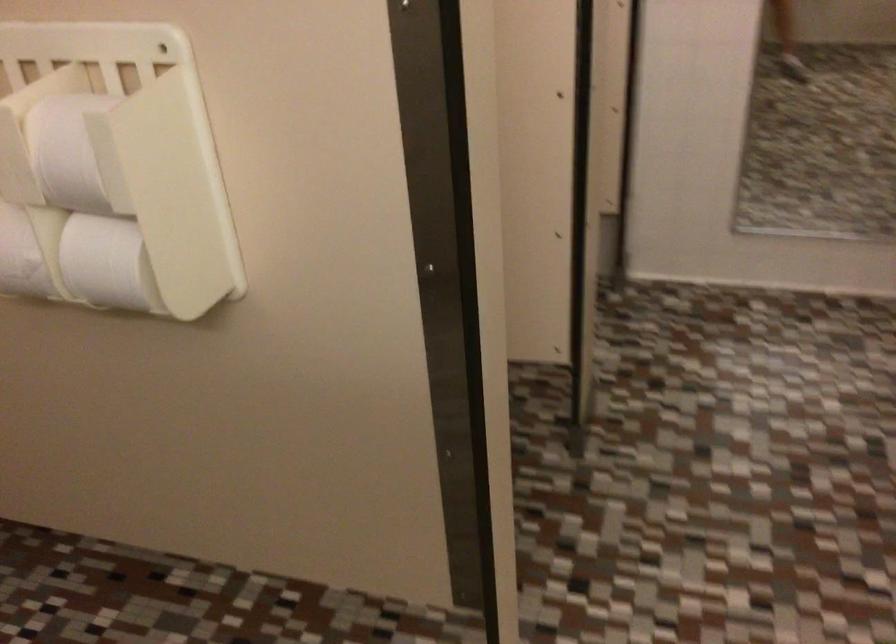
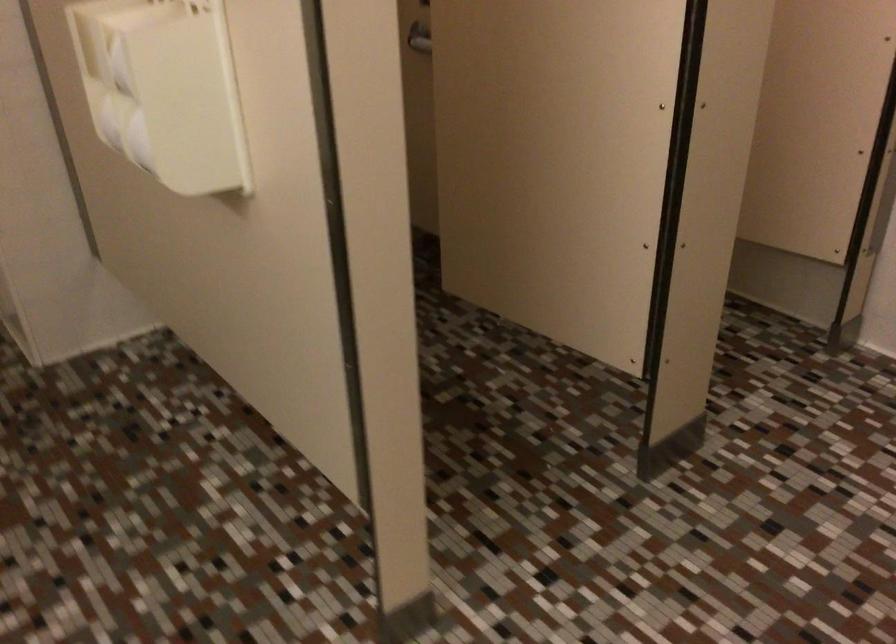
Where in the second image is the point corresponding to [158,192] from the first image?

(164, 90)